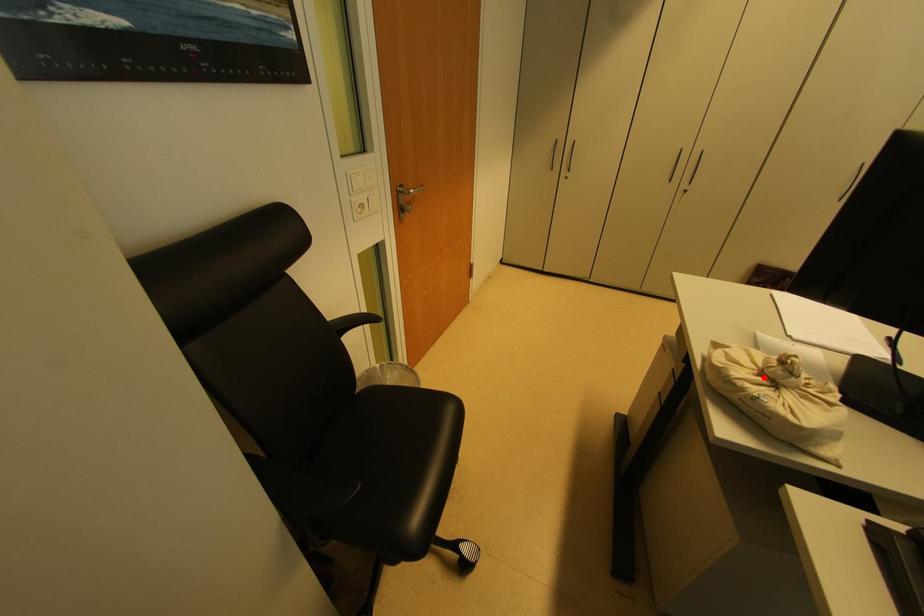
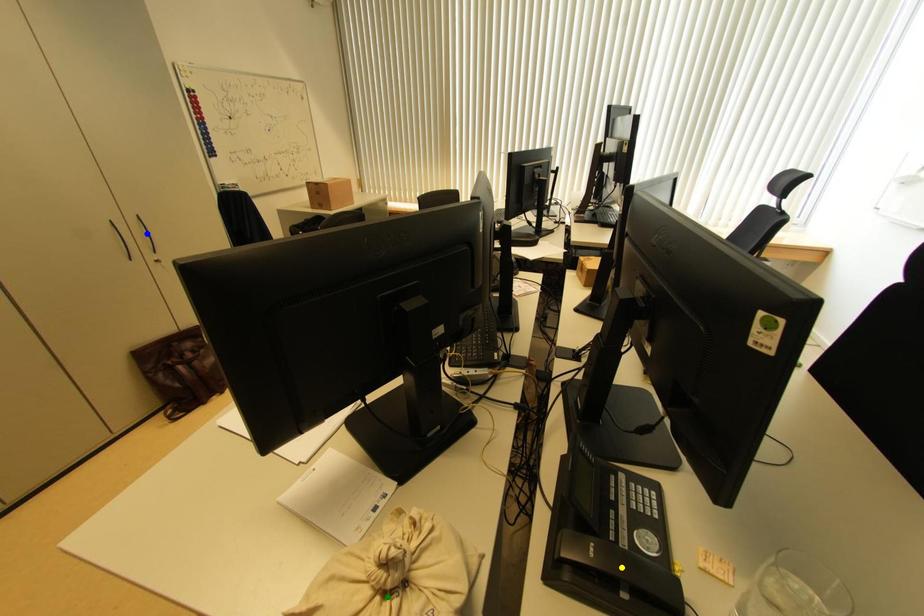
Question: I am providing you with two images of the same scene from different viewpoints. A red point is marked on the first image. You are given multiple points on the second image. Which point in image 2 is actually the same real-world point as the red point in image 1?

Choices:
 (A) blue point
 (B) yellow point
 (C) green point

Answer: (C)